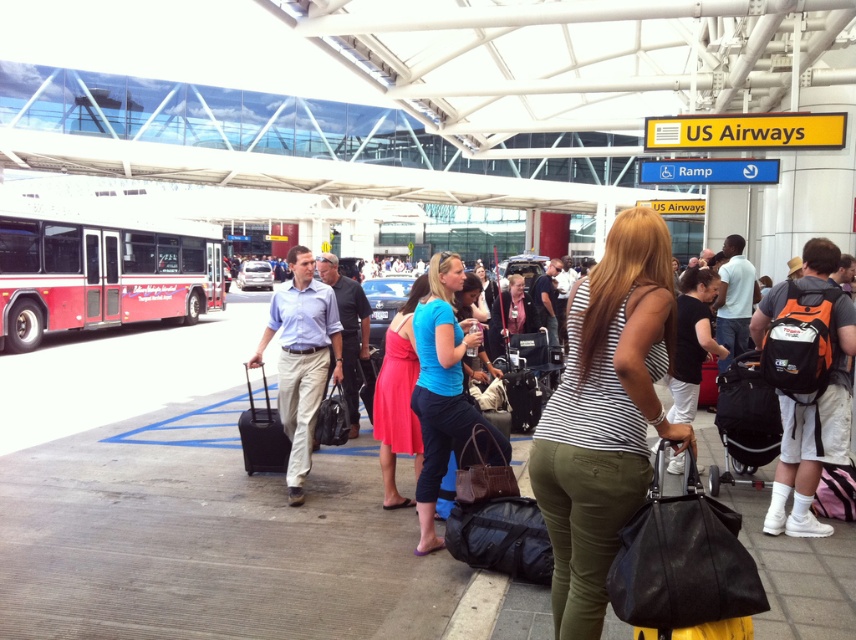
Between striped fabric tank top at center and blue fabric dress at center, which one appears on the right side from the viewer's perspective?

From the viewer's perspective, striped fabric tank top at center appears more on the right side.

Based on the photo, which is below, striped fabric tank top at center or blue fabric dress at center?

blue fabric dress at center

Who is more distant from viewer, (667, 252) or (441, 317)?

Point (441, 317)

Find the location of `striped fabric tank top at center`. striped fabric tank top at center is located at coordinates (605, 416).

Is blue fabric dress at center taller than black hard suitcase at center?

Yes, blue fabric dress at center is taller than black hard suitcase at center.

Locate an element on the screen. This screenshot has height=640, width=856. blue fabric dress at center is located at coordinates (443, 388).

Is point (415, 333) positioned after point (524, 387)?

No, (415, 333) is closer to viewer.

I want to click on blue fabric dress at center, so click(x=443, y=388).

Which is more to the left, orange and black backpack at right or black hard suitcase at center?

From the viewer's perspective, black hard suitcase at center appears more on the left side.

What are the coordinates of `orange and black backpack at right` in the screenshot? It's located at (806, 381).

Find the location of a particular element. The image size is (856, 640). orange and black backpack at right is located at coordinates (806, 381).

You are a GUI agent. You are given a task and a screenshot of the screen. Output one action in this format:
    pyautogui.click(x=<x>, y=<y>)
    Task: Click on the orange and black backpack at right
    This screenshot has width=856, height=640.
    Given the screenshot: What is the action you would take?
    pyautogui.click(x=806, y=381)